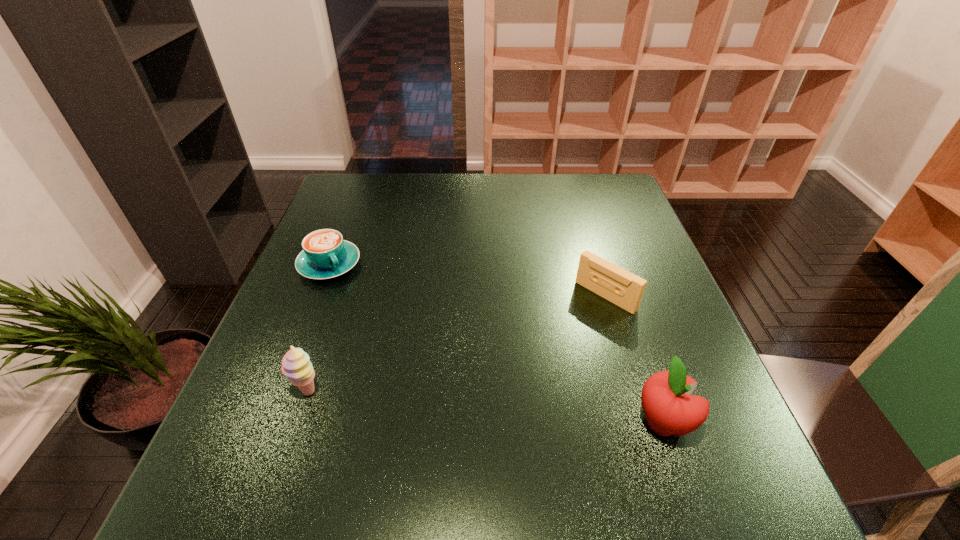
Where is `free space located at the front of the videotape with spools`? Image resolution: width=960 pixels, height=540 pixels. free space located at the front of the videotape with spools is located at coordinates coord(493,401).

Where is `free space located 0.080m at the front of the videotape with spools`? The image size is (960, 540). free space located 0.080m at the front of the videotape with spools is located at coordinates (570, 328).

Where is `object positioned at the near edge`? The image size is (960, 540). object positioned at the near edge is located at coordinates (670, 409).

The image size is (960, 540). I want to click on sherbert at the left edge, so [x=296, y=365].

At what (x,y) coordinates should I click in order to perform the action: click on cappuccino situated at the left edge. Please return your answer as a coordinate pair (x, y). Image resolution: width=960 pixels, height=540 pixels. Looking at the image, I should click on (325, 255).

At what (x,y) coordinates should I click in order to perform the action: click on apple that is positioned at the right edge. Please return your answer as a coordinate pair (x, y). Looking at the image, I should click on (670, 409).

Where is `videotape that is positioned at the right edge`? videotape that is positioned at the right edge is located at coordinates (619, 286).

Locate an element on the screen. object positioned at the near right corner is located at coordinates (670, 409).

Identify the location of blank area at the far edge. This screenshot has height=540, width=960. (397, 174).

At what (x,y) coordinates should I click in order to perform the action: click on vacant area at the near edge. Please return your answer as a coordinate pair (x, y). The height and width of the screenshot is (540, 960). Looking at the image, I should click on (516, 437).